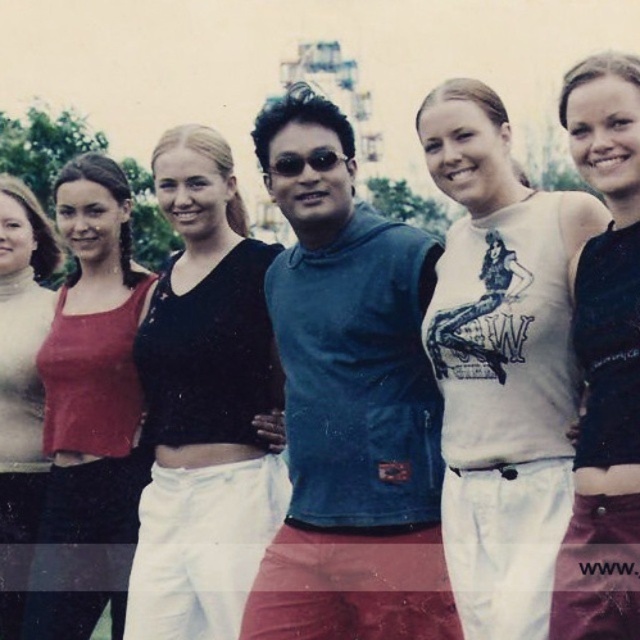
You are a photographer trying to adjust the positions of the two subjects wearing the blue fabric sleeveless shirt at center and the matte red tank top at left. According to the current arrangement, which subject is positioned to the right of the other?

The blue fabric sleeveless shirt at center is to the right of matte red tank top at left.

You are a photographer trying to adjust the lighting for a photo shoot. You notice two tank tops in the image, the white cotton tank top at center and the black matte tank top at center. Which tank top might require more careful lighting to avoid glare, and why?

The black matte tank top at center might require more careful lighting to avoid glare because matte surfaces can sometimes reflect light in unexpected ways, especially if the lighting is not diffused properly. However, since the white cotton tank top at center is larger, its surface area could also catch more light, but matte surfaces generally have a lower reflectivity compared to glossy ones. Wait, actually, matte surfaces scatter light more, reducing glare, while glossy surfaces reflect light more like a

Consider the image. You are a photographer trying to decide which of the two black tank tops in the image to focus on. The black matte tank top at center and the matte black tank top at left are both in view. Which one should you choose if you want to focus on the larger one?

The black matte tank top at center is bigger than the matte black tank top at left, so you should focus on the black matte tank top at center.